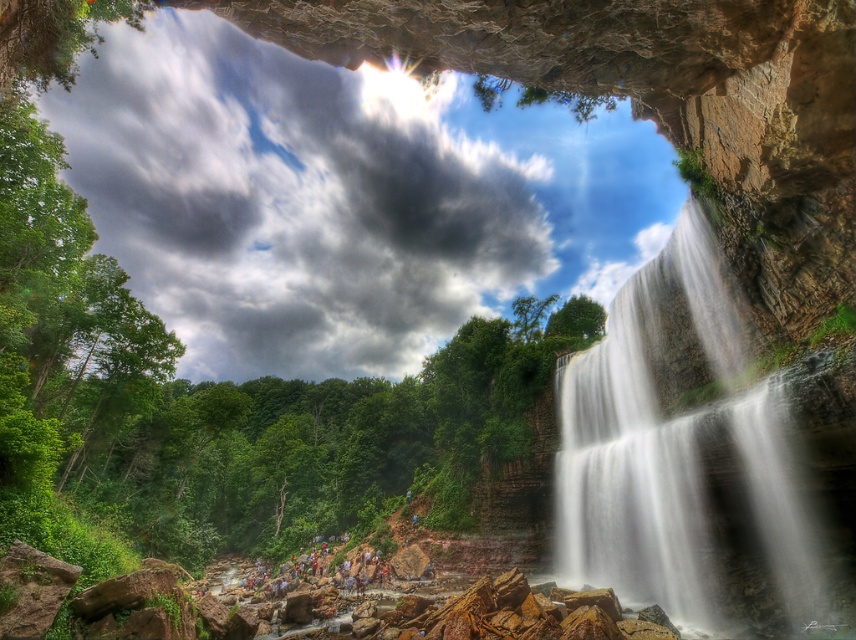
You are a photographer planning to capture the white textured water at right and the multicolored clothing at center in your shot. Which object should you focus on first if you want to ensure both are in the frame without moving the camera?

You should focus on the white textured water at right first because it is larger in size than the multicolored clothing at center, making it easier to frame initially while ensuring the smaller object remains within the shot.

In the scene shown: You are standing inside the cave opening and want to take a photo of the multicolored clothing at center and the white textured water at right. Which object will appear closer to the camera in the photo?

The white textured water at right will appear closer to the camera in the photo because it is positioned in front of the multicolored clothing at center.

From the picture: You are standing inside the cave and looking out at the waterfall. There are two points marked in the scene. The first point is at coordinates point (572, 525) and the second point is at point (308, 566). Which point is closer to you?

Point (572, 525) is in front of point (308, 566), so it is closer to you.